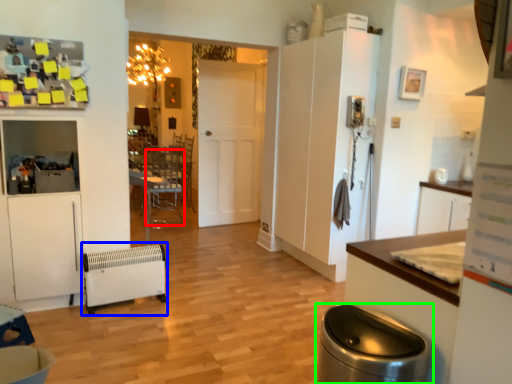
Question: Which object is positioned farthest from armchair (highlighted by a red box)? Select from appliance (highlighted by a blue box) and waste container (highlighted by a green box).

Choices:
 (A) appliance
 (B) waste container

Answer: (B)